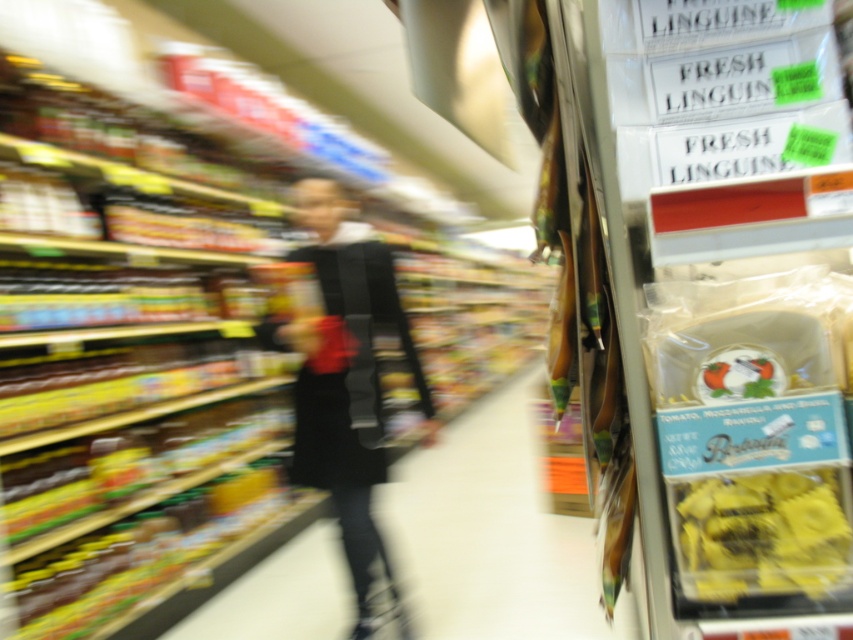
Between matte black bag at center and yellow matte pasta at right, which one appears on the left side from the viewer's perspective?

Positioned to the left is matte black bag at center.

Locate an element on the screen. Image resolution: width=853 pixels, height=640 pixels. matte black bag at center is located at coordinates (491, 532).

Which is behind, point (521, 433) or point (804, 579)?

The point (521, 433) is behind.

This screenshot has width=853, height=640. I want to click on matte black bag at center, so click(x=491, y=532).

Who is more distant from viewer, [412,344] or [722,579]?

The point [412,344] is behind.

This screenshot has width=853, height=640. What do you see at coordinates (346, 378) in the screenshot?
I see `black fabric at center` at bounding box center [346, 378].

Between point (312, 403) and point (781, 488), which one is positioned in front?

Point (781, 488)

At what (x,y) coordinates should I click in order to perform the action: click on black fabric at center. Please return your answer as a coordinate pair (x, y). The width and height of the screenshot is (853, 640). Looking at the image, I should click on (346, 378).

How much distance is there between matte black bag at center and black fabric at center?

matte black bag at center is 1.45 meters from black fabric at center.

Is matte black bag at center thinner than black fabric at center?

No.

Identify the location of matte black bag at center. (491, 532).